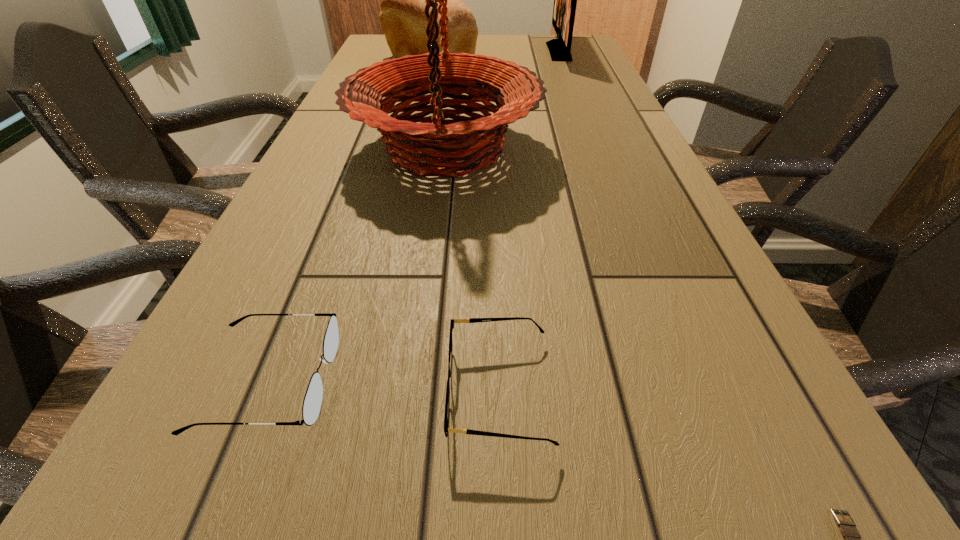
Find the location of a particular element. vacant region between the left spectacles and the right spectacles is located at coordinates (384, 386).

Locate an element on the screen. This screenshot has width=960, height=540. object that stands as the fourth closest to the bread is located at coordinates (469, 320).

Identify the location of object that is the closest to the bread. (413, 146).